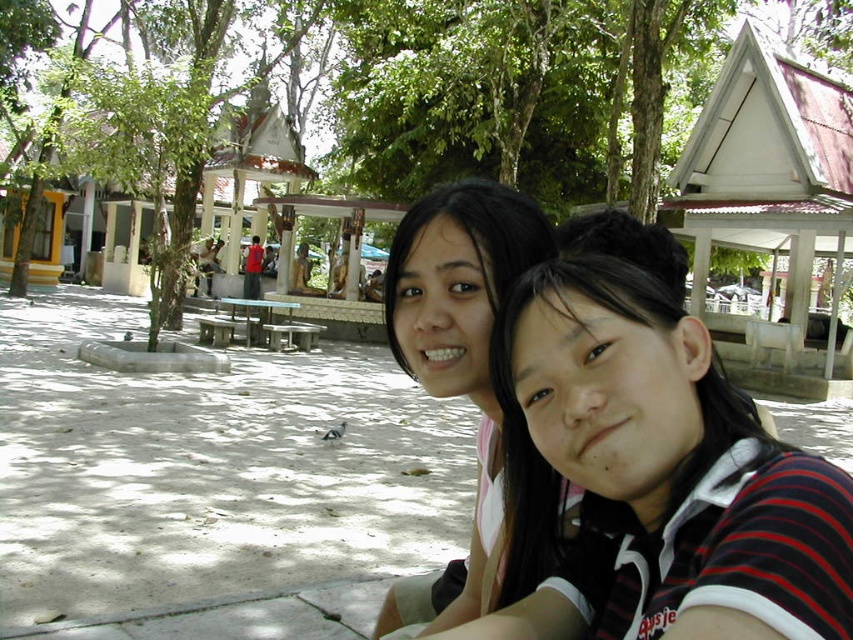
Question: Which is nearer to the matte black shirt at center?

Choices:
 (A) green leafy tree at center
 (B) smooth black hair at center

Answer: (B)

Question: Is green leafy tree at center wider than smooth black hair at center?

Choices:
 (A) no
 (B) yes

Answer: (B)

Question: Can you confirm if matte black shirt at center is smaller than green leafy tree at center?

Choices:
 (A) yes
 (B) no

Answer: (A)

Question: Considering the relative positions of matte black shirt at center and green leafy tree at center in the image provided, where is matte black shirt at center located with respect to green leafy tree at center?

Choices:
 (A) above
 (B) below

Answer: (B)

Question: Based on their relative distances, which object is nearer to the smooth black hair at center?

Choices:
 (A) green leafy tree at center
 (B) matte black shirt at center

Answer: (B)

Question: Which point is farther to the camera?

Choices:
 (A) 488,218
 (B) 604,492

Answer: (A)